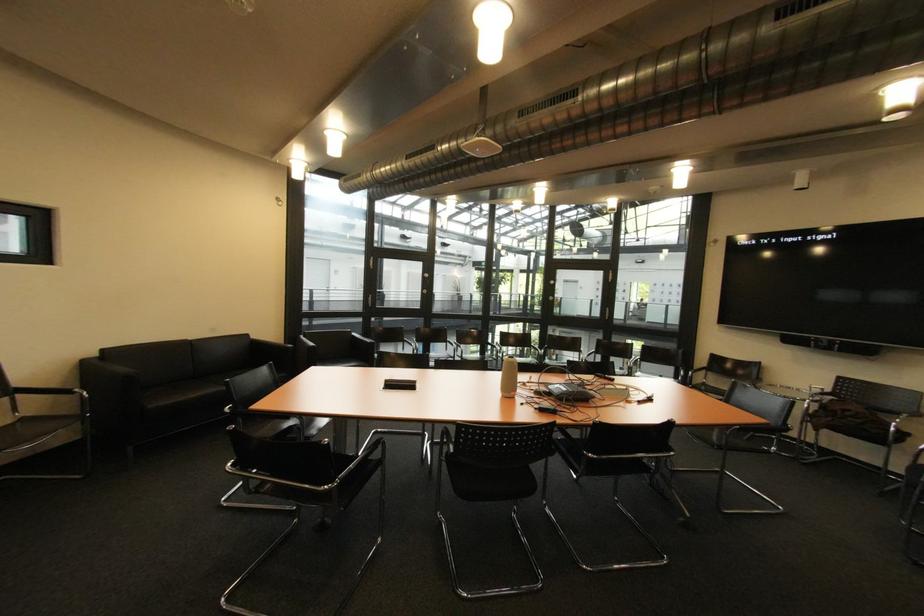
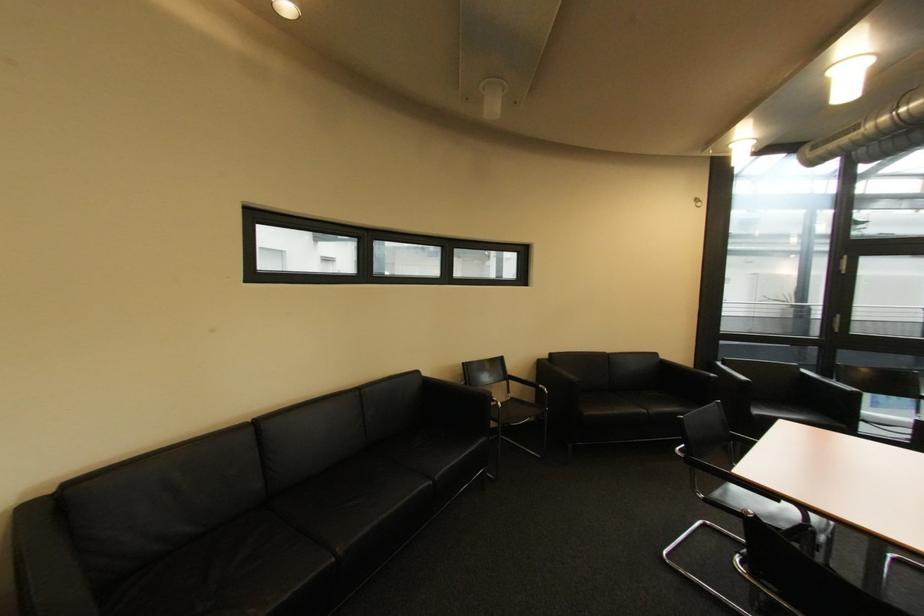
Question: The images are taken continuously from a first-person perspective. In which direction is your viewpoint rotating?

Choices:
 (A) Left
 (B) Right
 (C) Up
 (D) Down

Answer: (A)